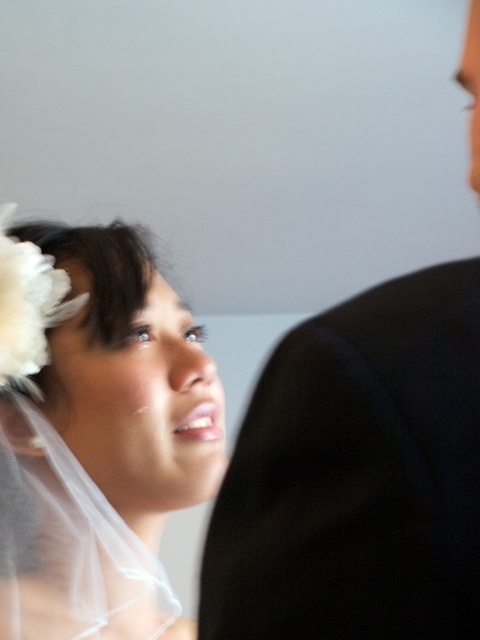
You are a photographer adjusting the camera focus. The subject is the bride with her white floral hair accessory and sheer veil. There is a black fabric at right. If you focus on the point at coordinates point [358,476], will it align with the black fabric at right?

Yes, the point [358,476] corresponds to the black fabric at right, so focusing there will align with the black fabric at right.

In the image of the bride, there are two items present. One is the black fabric at right and the other is the white sheer veil at upper left. Which of these two items is smaller in size?

The black fabric at right is smaller than the white sheer veil at upper left.